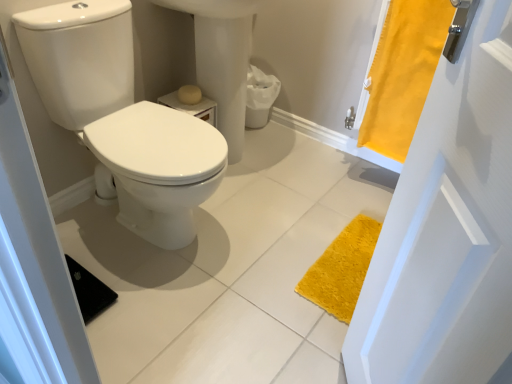
Question: Should I look upward or downward to see white glossy sink at center?

Choices:
 (A) down
 (B) up

Answer: (B)

Question: Is yellow fabric curtain at right a part of matte yellow toilet paper at center?

Choices:
 (A) no
 (B) yes

Answer: (A)

Question: From the image's perspective, is matte yellow toilet paper at center beneath yellow fabric curtain at right?

Choices:
 (A) no
 (B) yes

Answer: (B)

Question: Is matte yellow toilet paper at center closer to camera compared to yellow fabric curtain at right?

Choices:
 (A) no
 (B) yes

Answer: (A)

Question: Considering the relative positions of matte yellow toilet paper at center and yellow fabric curtain at right in the image provided, is matte yellow toilet paper at center to the right of yellow fabric curtain at right from the viewer's perspective?

Choices:
 (A) yes
 (B) no

Answer: (B)

Question: Is matte yellow toilet paper at center shorter than yellow fabric curtain at right?

Choices:
 (A) yes
 (B) no

Answer: (A)

Question: Considering the relative sizes of matte yellow toilet paper at center and yellow fabric curtain at right in the image provided, is matte yellow toilet paper at center wider than yellow fabric curtain at right?

Choices:
 (A) yes
 (B) no

Answer: (B)

Question: Considering the relative sizes of matte yellow toilet paper at center and white glossy sink at center in the image provided, is matte yellow toilet paper at center thinner than white glossy sink at center?

Choices:
 (A) yes
 (B) no

Answer: (A)

Question: Are matte yellow toilet paper at center and white glossy sink at center beside each other?

Choices:
 (A) yes
 (B) no

Answer: (B)

Question: Is matte yellow toilet paper at center shorter than white glossy sink at center?

Choices:
 (A) no
 (B) yes

Answer: (B)

Question: Can we say matte yellow toilet paper at center lies outside white glossy sink at center?

Choices:
 (A) no
 (B) yes

Answer: (A)

Question: Is matte yellow toilet paper at center at the right side of white glossy sink at center?

Choices:
 (A) yes
 (B) no

Answer: (B)

Question: Does matte yellow toilet paper at center have a larger size compared to white glossy sink at center?

Choices:
 (A) yes
 (B) no

Answer: (B)

Question: From a real-world perspective, is white glossy toilet at left physically above yellow fabric curtain at right?

Choices:
 (A) no
 (B) yes

Answer: (A)